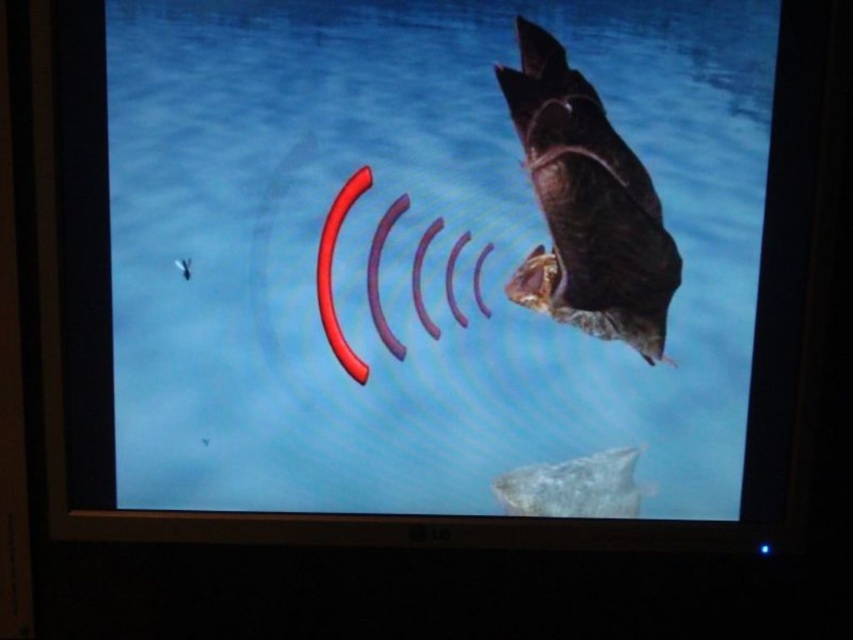
Is the position of shiny metallic fish at right more distant than that of smooth gray fish at bottom center?

No, it is not.

What do you see at coordinates (589, 204) in the screenshot? This screenshot has height=640, width=853. I see `shiny metallic fish at right` at bounding box center [589, 204].

Identify the location of shiny metallic fish at right. (589, 204).